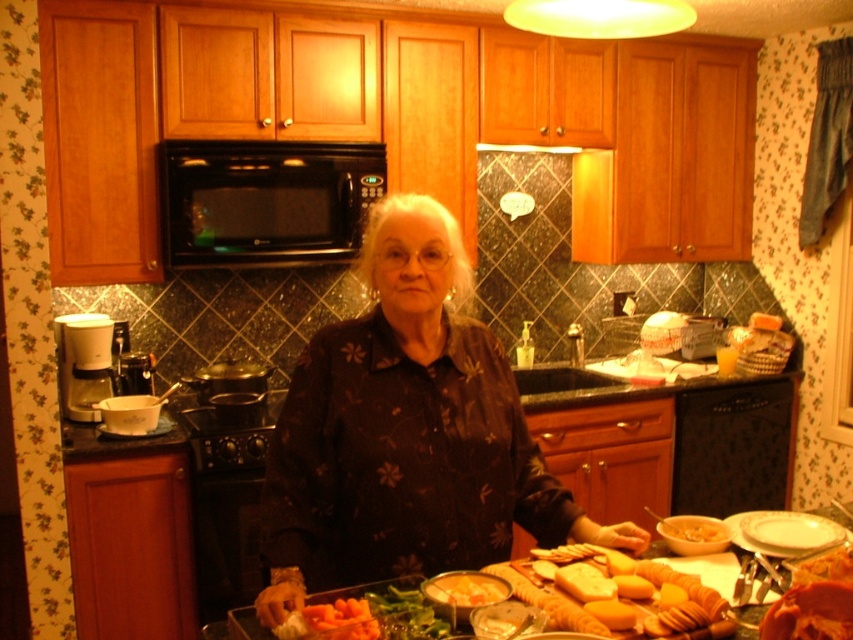
Question: Among these objects, which one is nearest to the camera?

Choices:
 (A) black matte microwave at upper center
 (B) white glossy plate at lower right

Answer: (B)

Question: Is the position of dark floral shirt at center less distant than that of metallic silver exhaust hood at upper center?

Choices:
 (A) no
 (B) yes

Answer: (B)

Question: Which object appears closest to the camera in this image?

Choices:
 (A) black matte microwave at upper center
 (B) yellowish matte bread at lower center
 (C) green leafy vegetable at center

Answer: (C)

Question: Is white glossy plate at lower right behind metallic silver exhaust hood at upper center?

Choices:
 (A) no
 (B) yes

Answer: (A)

Question: From the image, what is the correct spatial relationship of black matte microwave at upper center in relation to yellowish matte bread at lower center?

Choices:
 (A) left
 (B) right

Answer: (A)

Question: Which point appears farthest from the camera in this image?

Choices:
 (A) (403, 204)
 (B) (428, 604)
 (C) (692, 516)

Answer: (C)